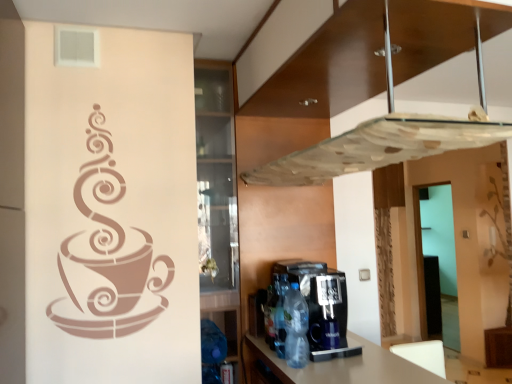
Question: Which direction should I rotate to look at translucent plastic bottle at lower center, marked as the 3th bottle in a back-to-front arrangement?

Choices:
 (A) right
 (B) left

Answer: (A)

Question: Can you confirm if black plastic coffee machine at lower center is taller than translucent plastic bottle at center, which ranks as the 2th bottle in back-to-front order?

Choices:
 (A) no
 (B) yes

Answer: (B)

Question: From the image's perspective, is black plastic coffee machine at lower center on translucent plastic bottle at center, which ranks as the 2th bottle in front-to-back order?

Choices:
 (A) yes
 (B) no

Answer: (A)

Question: Can you confirm if black plastic coffee machine at lower center is bigger than translucent plastic bottle at center, which ranks as the 2th bottle in back-to-front order?

Choices:
 (A) yes
 (B) no

Answer: (A)

Question: Is black plastic coffee machine at lower center oriented away from translucent plastic bottle at center, which ranks as the 2th bottle in front-to-back order?

Choices:
 (A) no
 (B) yes

Answer: (A)

Question: Considering the relative sizes of black plastic coffee machine at lower center and translucent plastic bottle at center, which ranks as the 2th bottle in front-to-back order, in the image provided, is black plastic coffee machine at lower center thinner than translucent plastic bottle at center, which ranks as the 2th bottle in front-to-back order,?

Choices:
 (A) no
 (B) yes

Answer: (A)

Question: Is black plastic coffee machine at lower center oriented towards translucent plastic bottle at center, which ranks as the 2th bottle in back-to-front order?

Choices:
 (A) no
 (B) yes

Answer: (A)

Question: Can you see translucent plastic bottle at lower center, marked as the 3th bottle in a back-to-front arrangement, touching black plastic coffee machine at lower center?

Choices:
 (A) yes
 (B) no

Answer: (B)

Question: From the image's perspective, would you say translucent plastic bottle at lower center, marked as the 3th bottle in a back-to-front arrangement, is positioned over black plastic coffee machine at lower center?

Choices:
 (A) yes
 (B) no

Answer: (B)

Question: Is translucent plastic bottle at lower center, which is the 1th bottle from front to back, not close to black plastic coffee machine at lower center?

Choices:
 (A) yes
 (B) no

Answer: (B)

Question: Can you confirm if translucent plastic bottle at lower center, marked as the 3th bottle in a back-to-front arrangement, is shorter than black plastic coffee machine at lower center?

Choices:
 (A) no
 (B) yes

Answer: (B)

Question: Is translucent plastic bottle at lower center, marked as the 3th bottle in a back-to-front arrangement, facing away from black plastic coffee machine at lower center?

Choices:
 (A) no
 (B) yes

Answer: (B)

Question: Is translucent plastic bottle at lower center, marked as the 3th bottle in a back-to-front arrangement, in front of black plastic coffee machine at lower center?

Choices:
 (A) yes
 (B) no

Answer: (B)

Question: Does transparent glass door at right have a greater width compared to translucent plastic bottle at center, which ranks as the 1th bottle in back-to-front order?

Choices:
 (A) yes
 (B) no

Answer: (A)